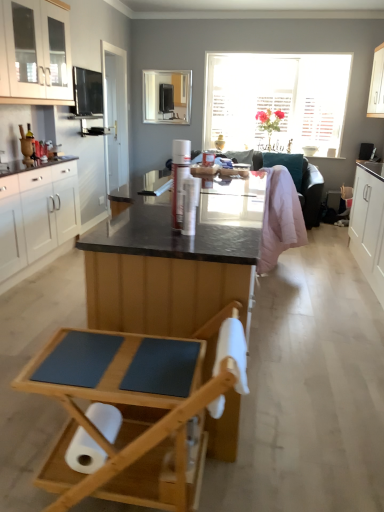
The height and width of the screenshot is (512, 384). What are the coordinates of `free space above matte black tv at upper center (from a real-world perspective)` in the screenshot? It's located at (172, 66).